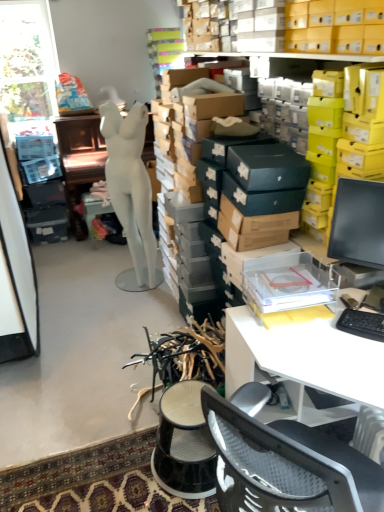
I want to click on vacant area situated to the left side of black plastic keyboard at right, so click(x=324, y=345).